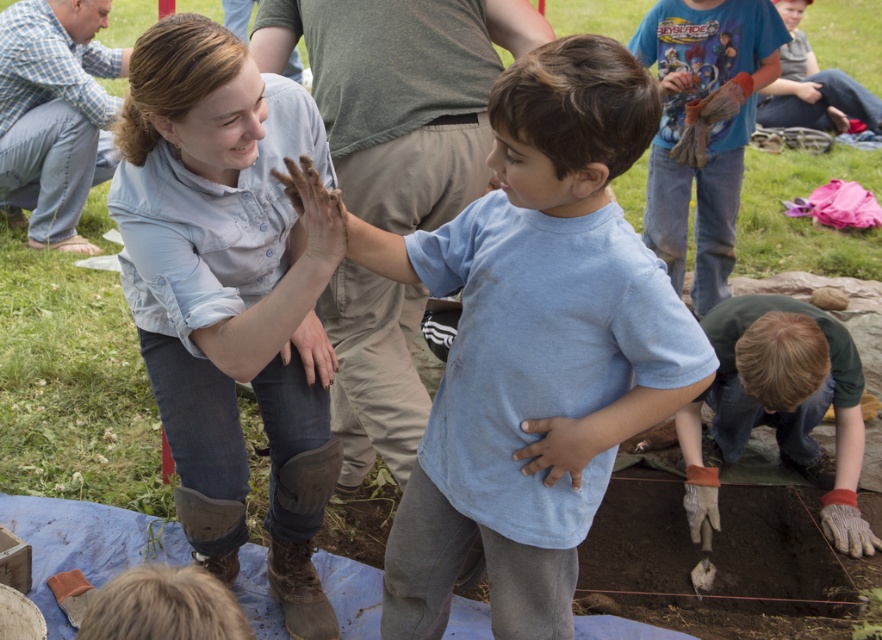
Between denim jeans at center and blue cotton shirt at upper center, which one is positioned lower?

denim jeans at center

Is denim jeans at center positioned before blue cotton shirt at upper center?

Yes, it is.

What do you see at coordinates (401, 93) in the screenshot? I see `denim jeans at center` at bounding box center [401, 93].

The width and height of the screenshot is (882, 640). In order to click on denim jeans at center in this screenshot , I will do `click(401, 93)`.

Between blue cotton shirt at center and blue cotton shirt at upper right, which one is positioned lower?

Positioned lower is blue cotton shirt at center.

Looking at this image, who is shorter, blue cotton shirt at center or blue cotton shirt at upper right?

blue cotton shirt at upper right

What do you see at coordinates (229, 296) in the screenshot?
I see `blue cotton shirt at center` at bounding box center [229, 296].

Where is `blue cotton shirt at center`? blue cotton shirt at center is located at coordinates pyautogui.click(x=229, y=296).

Does blue cotton shirt at upper right have a lesser height compared to blue cotton shirt at upper center?

Incorrect, blue cotton shirt at upper right's height does not fall short of blue cotton shirt at upper center's.

Does point (671, 136) come behind point (809, 112)?

No.

The width and height of the screenshot is (882, 640). I want to click on blue cotton shirt at upper right, so pos(709,131).

The width and height of the screenshot is (882, 640). I want to click on blue cotton shirt at upper right, so click(709, 131).